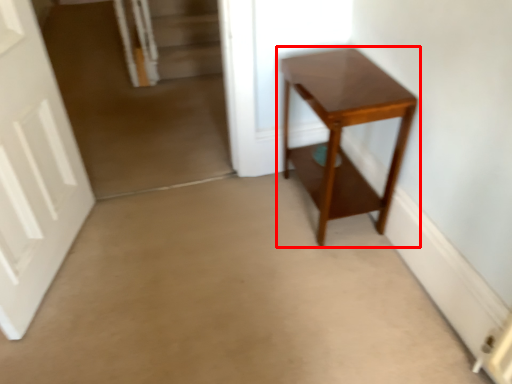
Question: From the image's perspective, considering the relative positions of table (annotated by the red box) and door in the image provided, where is table (annotated by the red box) located with respect to the staircase?

Choices:
 (A) below
 (B) above

Answer: (B)